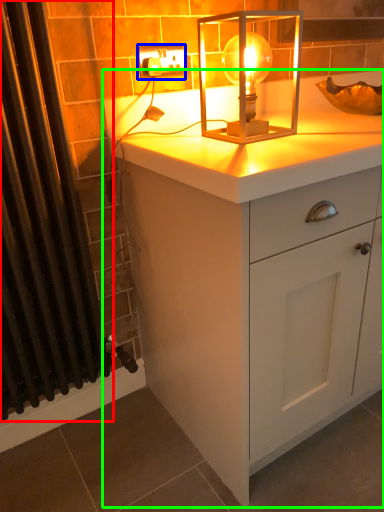
Question: Based on their relative distances, which object is nearer to shower curtain (highlighted by a red box)? Choose from electric outlet (highlighted by a blue box) and chest of drawers (highlighted by a green box).

Choices:
 (A) electric outlet
 (B) chest of drawers

Answer: (B)